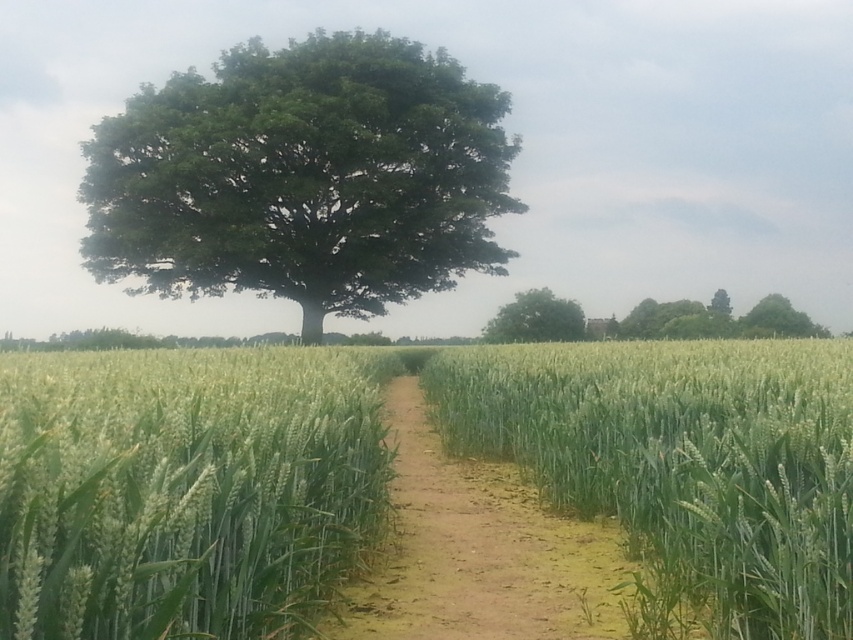
The height and width of the screenshot is (640, 853). I want to click on green matte wheat at center, so click(184, 488).

Can you confirm if green matte wheat at center is shorter than green grassy wheat field at center?

Correct, green matte wheat at center is not as tall as green grassy wheat field at center.

This screenshot has width=853, height=640. I want to click on green matte wheat at center, so click(184, 488).

Where is `green matte wheat at center`? green matte wheat at center is located at coordinates (184, 488).

Locate an element on the screen. The image size is (853, 640). green leafy oak tree at center is located at coordinates (303, 177).

Based on the photo, between green leafy oak tree at center and green leafy tree at upper right, which one has less height?

With less height is green leafy tree at upper right.

Is point (378, 188) farther from camera compared to point (769, 332)?

No.

In order to click on green leafy oak tree at center in this screenshot , I will do `click(303, 177)`.

Between green matte wheat at center and dull brown dirt path at center, which one has less height?

green matte wheat at center is shorter.

In the scene shown: Between green matte wheat at center and dull brown dirt path at center, which one appears on the left side from the viewer's perspective?

green matte wheat at center

At what (x,y) coordinates should I click in order to perform the action: click on green matte wheat at center. Please return your answer as a coordinate pair (x, y). The image size is (853, 640). Looking at the image, I should click on (184, 488).